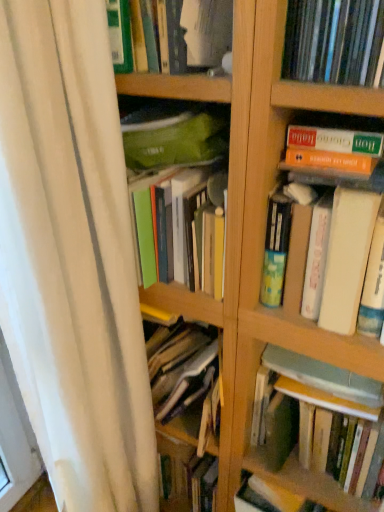
Find the location of a particular element. matte plastic books at upper right, the 3th book positioned from the bottom is located at coordinates (334, 42).

Locate an element on the screen. The image size is (384, 512). hardcover book at center, acting as the 1th book starting from the bottom is located at coordinates (313, 438).

This screenshot has height=512, width=384. What do you see at coordinates (199, 32) in the screenshot? I see `green matte book at upper center, marked as the 4th book in a bottom-to-top arrangement` at bounding box center [199, 32].

The height and width of the screenshot is (512, 384). What are the coordinates of `hardcover book at upper right, the third book when ordered from top to bottom` in the screenshot? It's located at (344, 215).

Consider the image. From a real-world perspective, between matte plastic books at upper right, the 2th book positioned from the top, and hardcover book at center, acting as the 1th book starting from the bottom, who is vertically higher?

In real-world perspective, matte plastic books at upper right, the 2th book positioned from the top, is above.

Is matte plastic books at upper right, the 3th book positioned from the bottom, located outside hardcover book at center, acting as the 1th book starting from the bottom?

matte plastic books at upper right, the 3th book positioned from the bottom, is positioned outside hardcover book at center, acting as the 1th book starting from the bottom.

Does matte plastic books at upper right, the 3th book positioned from the bottom, have a smaller size compared to hardcover book at center, acting as the 1th book starting from the bottom?

Indeed, matte plastic books at upper right, the 3th book positioned from the bottom, has a smaller size compared to hardcover book at center, acting as the 1th book starting from the bottom.

Which object is positioned more to the left, matte plastic books at upper right, the 3th book positioned from the bottom, or hardcover book at center, acting as the 1th book starting from the bottom?

From the viewer's perspective, matte plastic books at upper right, the 3th book positioned from the bottom, appears more on the left side.

Is there a large distance between matte plastic books at upper right, the 3th book positioned from the bottom, and hardcover book at upper right, the third book when ordered from top to bottom?

No, matte plastic books at upper right, the 3th book positioned from the bottom, is in close proximity to hardcover book at upper right, the third book when ordered from top to bottom.

Considering the sizes of matte plastic books at upper right, the 2th book positioned from the top, and hardcover book at upper right, the second book when ordered from bottom to top, in the image, is matte plastic books at upper right, the 2th book positioned from the top, wider or thinner than hardcover book at upper right, the second book when ordered from bottom to top,?

matte plastic books at upper right, the 2th book positioned from the top, is wider than hardcover book at upper right, the second book when ordered from bottom to top.

Relative to hardcover book at upper right, the third book when ordered from top to bottom, is matte plastic books at upper right, the 3th book positioned from the bottom, in front or behind?

In the image, matte plastic books at upper right, the 3th book positioned from the bottom, appears in front of hardcover book at upper right, the third book when ordered from top to bottom.

Between point (115, 14) and point (279, 447), which one is positioned in front?

Point (115, 14)

Is green matte book at upper center, marked as the 4th book in a bottom-to-top arrangement, oriented towards hardcover book at center, arranged as the 4th book when viewed from the top?

No, green matte book at upper center, marked as the 4th book in a bottom-to-top arrangement, is not aimed at hardcover book at center, arranged as the 4th book when viewed from the top.

Is green matte book at upper center, arranged as the first book when viewed from the top, at the right side of hardcover book at center, acting as the 1th book starting from the bottom?

Incorrect, green matte book at upper center, arranged as the first book when viewed from the top, is not on the right side of hardcover book at center, acting as the 1th book starting from the bottom.

Is green matte book at upper center, arranged as the first book when viewed from the top, next to hardcover book at center, acting as the 1th book starting from the bottom, and touching it?

No, green matte book at upper center, arranged as the first book when viewed from the top, is not next to hardcover book at center, acting as the 1th book starting from the bottom.

Does hardcover book at upper right, the third book when ordered from top to bottom, have a lesser width compared to matte plastic books at upper right, the 2th book positioned from the top?

Yes.

From the image's perspective, is hardcover book at upper right, the third book when ordered from top to bottom, beneath matte plastic books at upper right, the 2th book positioned from the top?

Yes, from the image's perspective, hardcover book at upper right, the third book when ordered from top to bottom, is beneath matte plastic books at upper right, the 2th book positioned from the top.

From the picture: Is hardcover book at upper right, the second book when ordered from bottom to top, oriented away from matte plastic books at upper right, the 3th book positioned from the bottom?

No, matte plastic books at upper right, the 3th book positioned from the bottom, is not at the back of hardcover book at upper right, the second book when ordered from bottom to top.

Which is more to the right, hardcover book at upper right, the second book when ordered from bottom to top, or matte plastic books at upper right, the 2th book positioned from the top?

hardcover book at upper right, the second book when ordered from bottom to top.

Does point (159, 29) appear closer or farther from the camera than point (335, 58)?

Clearly, point (159, 29) is more distant from the camera than point (335, 58).

Can you tell me how much green matte book at upper center, marked as the 4th book in a bottom-to-top arrangement, and matte plastic books at upper right, the 2th book positioned from the top, differ in facing direction?

The angular difference between green matte book at upper center, marked as the 4th book in a bottom-to-top arrangement, and matte plastic books at upper right, the 2th book positioned from the top, is 0.000442 degrees.

Locate an element on the screen. The image size is (384, 512). book that is the 1st one when counting downward from the green matte book at upper center, arranged as the first book when viewed from the top (from the image's perspective) is located at coordinates (334, 42).

Who is taller, green matte book at upper center, marked as the 4th book in a bottom-to-top arrangement, or matte plastic books at upper right, the 2th book positioned from the top?

green matte book at upper center, marked as the 4th book in a bottom-to-top arrangement, is taller.

Is point (343, 506) less distant than point (72, 39)?

No, it is not.

From the image's perspective, would you say hardcover book at center, acting as the 1th book starting from the bottom, is shown under white fabric shower curtain at left?

Yes.

Is hardcover book at center, acting as the 1th book starting from the bottom, positioned before white fabric shower curtain at left?

No, hardcover book at center, acting as the 1th book starting from the bottom, is behind white fabric shower curtain at left.

Is hardcover book at center, arranged as the 4th book when viewed from the top, with hardcover book at upper right, the second book when ordered from bottom to top?

No, hardcover book at center, arranged as the 4th book when viewed from the top, is not making contact with hardcover book at upper right, the second book when ordered from bottom to top.

Who is taller, hardcover book at center, arranged as the 4th book when viewed from the top, or hardcover book at upper right, the third book when ordered from top to bottom?

Standing taller between the two is hardcover book at upper right, the third book when ordered from top to bottom.

Measure the distance from hardcover book at center, arranged as the 4th book when viewed from the top, to hardcover book at upper right, the second book when ordered from bottom to top.

They are 12.44 inches apart.

The width and height of the screenshot is (384, 512). Find the location of `the 2nd book counting from the right side of the matte plastic books at upper right, the 2th book positioned from the top`. the 2nd book counting from the right side of the matte plastic books at upper right, the 2th book positioned from the top is located at coordinates (313, 438).

This screenshot has height=512, width=384. I want to click on book in front of the hardcover book at upper right, the second book when ordered from bottom to top, so click(334, 42).

Which object lies nearer to the anchor point green matte book at upper center, arranged as the first book when viewed from the top, matte plastic books at upper right, the 2th book positioned from the top, or hardcover book at upper right, the third book when ordered from top to bottom?

The object closer to green matte book at upper center, arranged as the first book when viewed from the top, is matte plastic books at upper right, the 2th book positioned from the top.

Estimate the real-world distances between objects in this image. Which object is further from hardcover book at center, acting as the 1th book starting from the bottom, hardcover book at upper right, the third book when ordered from top to bottom, or matte plastic books at upper right, the 2th book positioned from the top?

The object further to hardcover book at center, acting as the 1th book starting from the bottom, is matte plastic books at upper right, the 2th book positioned from the top.

Which object lies nearer to the anchor point matte plastic books at upper right, the 3th book positioned from the bottom, hardcover book at center, arranged as the 4th book when viewed from the top, or hardcover book at upper right, the third book when ordered from top to bottom?

The object closer to matte plastic books at upper right, the 3th book positioned from the bottom, is hardcover book at upper right, the third book when ordered from top to bottom.

From the image, which object appears to be nearer to hardcover book at upper right, the second book when ordered from bottom to top, white fabric shower curtain at left or hardcover book at center, acting as the 1th book starting from the bottom?

Among the two, hardcover book at center, acting as the 1th book starting from the bottom, is located nearer to hardcover book at upper right, the second book when ordered from bottom to top.

Which object lies further to the anchor point hardcover book at upper right, the second book when ordered from bottom to top, matte plastic books at upper right, the 2th book positioned from the top, or white fabric shower curtain at left?

white fabric shower curtain at left.

From the image, which object appears to be farther from hardcover book at center, arranged as the 4th book when viewed from the top, hardcover book at upper right, the second book when ordered from bottom to top, or white fabric shower curtain at left?

Among the two, white fabric shower curtain at left is located further to hardcover book at center, arranged as the 4th book when viewed from the top.

Looking at the image, which one is located further to hardcover book at upper right, the second book when ordered from bottom to top, hardcover book at center, acting as the 1th book starting from the bottom, or white fabric shower curtain at left?

Based on the image, white fabric shower curtain at left appears to be further to hardcover book at upper right, the second book when ordered from bottom to top.

Based on their spatial positions, is hardcover book at center, acting as the 1th book starting from the bottom, or matte plastic books at upper right, the 3th book positioned from the bottom, closer to white fabric shower curtain at left?

hardcover book at center, acting as the 1th book starting from the bottom, lies closer to white fabric shower curtain at left than the other object.

Locate an element on the screen. This screenshot has height=512, width=384. book between matte plastic books at upper right, the 2th book positioned from the top, and white fabric shower curtain at left, in the vertical direction is located at coordinates (344, 215).

At what (x,y) coordinates should I click in order to perform the action: click on shower curtain between green matte book at upper center, arranged as the first book when viewed from the top, and hardcover book at center, arranged as the 4th book when viewed from the top, in the up-down direction. Please return your answer as a coordinate pair (x, y). This screenshot has height=512, width=384. Looking at the image, I should click on (72, 258).

You are a GUI agent. You are given a task and a screenshot of the screen. Output one action in this format:
    pyautogui.click(x=<x>, y=<y>)
    Task: Click on the book between matte plastic books at upper right, the 2th book positioned from the top, and hardcover book at center, acting as the 1th book starting from the bottom, in the up-down direction
    The width and height of the screenshot is (384, 512).
    Given the screenshot: What is the action you would take?
    pyautogui.click(x=344, y=215)

Find the location of a particular element. book between green matte book at upper center, arranged as the first book when viewed from the top, and hardcover book at upper right, the third book when ordered from top to bottom, vertically is located at coordinates (334, 42).